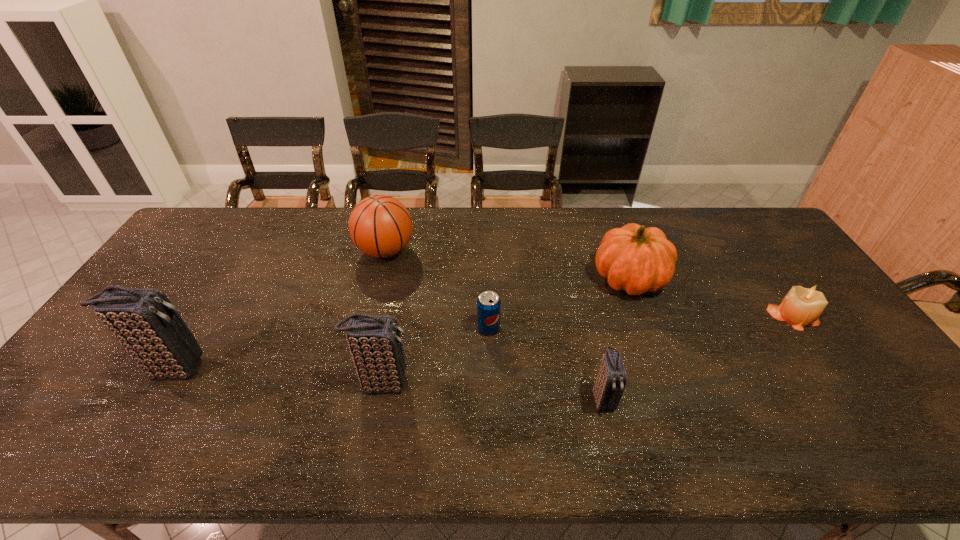
You are a GUI agent. You are given a task and a screenshot of the screen. Output one action in this format:
    pyautogui.click(x=<x>, y=<y>)
    Task: Click on the fifth closest object relative to the second shortest clutch bag
    The height and width of the screenshot is (540, 960).
    Given the screenshot: What is the action you would take?
    pyautogui.click(x=636, y=259)

Point out which object is positioned as the sixth nearest to the rightmost clutch bag. Please provide its 2D coordinates. Your answer should be formatted as a tuple, i.e. [(x, y)], where the tuple contains the x and y coordinates of a point satisfying the conditions above.

[(145, 322)]

At what (x,y) coordinates should I click in order to perform the action: click on clutch bag identified as the third closest to the fourth object from right to left. Please return your answer as a coordinate pair (x, y). The height and width of the screenshot is (540, 960). Looking at the image, I should click on 145,322.

Choose which clutch bag is the second nearest neighbor to the basketball. Please provide its 2D coordinates. Your answer should be formatted as a tuple, i.e. [(x, y)], where the tuple contains the x and y coordinates of a point satisfying the conditions above.

[(145, 322)]

Image resolution: width=960 pixels, height=540 pixels. I want to click on vacant point that satisfies the following two spatial constraints: 1. on the front side of the pop soda; 2. with the zip open on the second clutch bag from left to right, so click(490, 383).

Where is `free space that satisfies the following two spatial constraints: 1. on the front side of the candle; 2. with the zip open on the leftmost object`? This screenshot has height=540, width=960. free space that satisfies the following two spatial constraints: 1. on the front side of the candle; 2. with the zip open on the leftmost object is located at coordinates (828, 368).